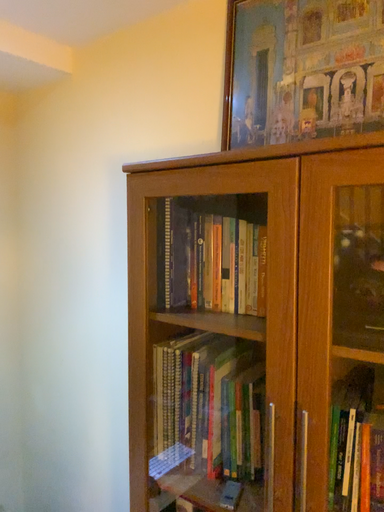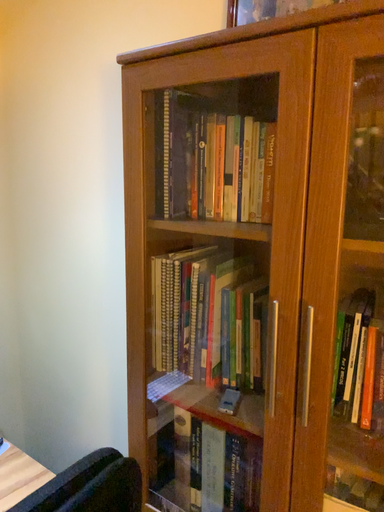
Question: How did the camera likely rotate when shooting the video?

Choices:
 (A) rotated upward
 (B) rotated downward

Answer: (B)